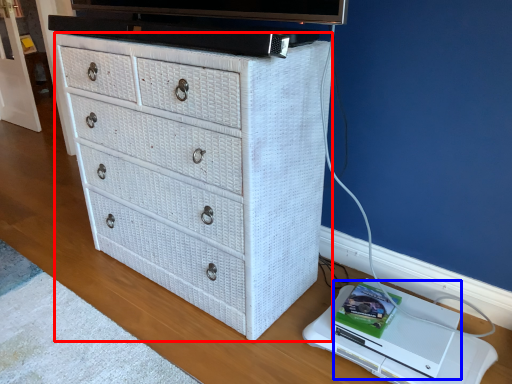
Question: Among these objects, which one is nearest to the camera, chest of drawers (highlighted by a red box) or computer (highlighted by a blue box)?

Choices:
 (A) chest of drawers
 (B) computer

Answer: (A)